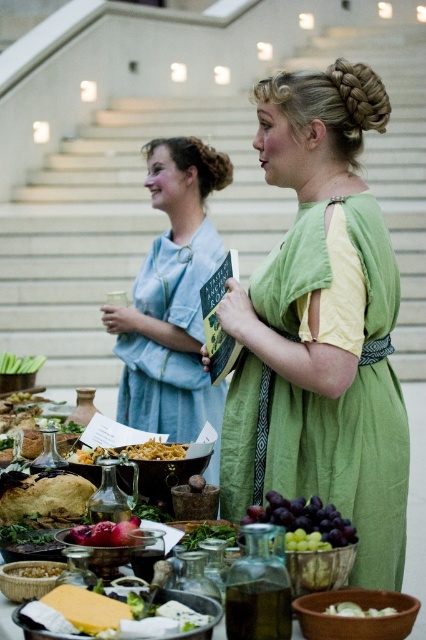
Is point (299, 244) positioned before point (123, 532)?

No.

Can you confirm if green velvet dress at center is positioned above purple matte pomegranate at lower center?

Yes, green velvet dress at center is above purple matte pomegranate at lower center.

Which is in front, point (322, 284) or point (106, 536)?

Point (106, 536)

Identify the location of green velvet dress at center. (321, 326).

Does green velvet dress at center appear on the right side of yellow cheese at lower left?

Correct, you'll find green velvet dress at center to the right of yellow cheese at lower left.

I want to click on green velvet dress at center, so click(x=321, y=326).

Between point (5, 609) and point (324, 508), which one is positioned in front?

Point (5, 609)

Who is shorter, matte glass bowl at center or purple matte grapes at center?

With less height is purple matte grapes at center.

Does point (296, 634) come behind point (253, 509)?

No, it is not.

Where is `matte glass bowl at center`? The height and width of the screenshot is (640, 426). matte glass bowl at center is located at coordinates (416, 502).